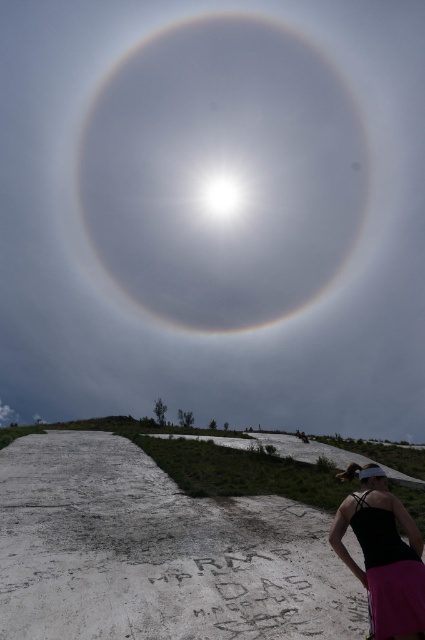
You are a photographer trying to capture the white translucent halo at upper center and the black fabric tank top at lower right in the same frame. Based on their positions, which object would appear higher in your photo?

The white translucent halo at upper center appears higher in the photo because it is located above the black fabric tank top at lower right.

Based on the photo, you are a photographer trying to capture the white translucent halo at upper center and the black fabric tank top at lower right in the same frame. Which object will appear bigger in your photo?

The white translucent halo at upper center will appear bigger in your photo because it is larger in size than the black fabric tank top at lower right.

You are standing on the pathway and looking up at the sky. Where is the white translucent halo at upper center positioned relative to the sun?

The white translucent halo at upper center is located at point (223,173), which means it is centered around the sun but slightly offset to the upper part of the sky.